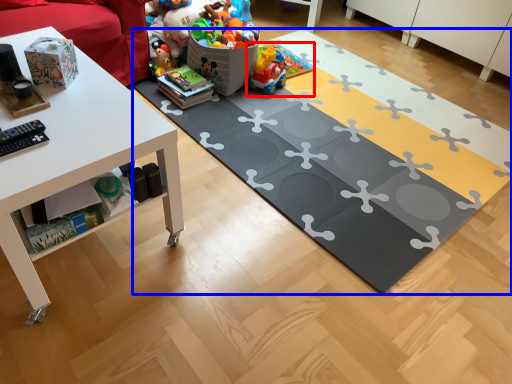
Question: Which point is closer to the camera, toy (highlighted by a red box) or yoga mat (highlighted by a blue box)?

Choices:
 (A) toy
 (B) yoga mat

Answer: (B)